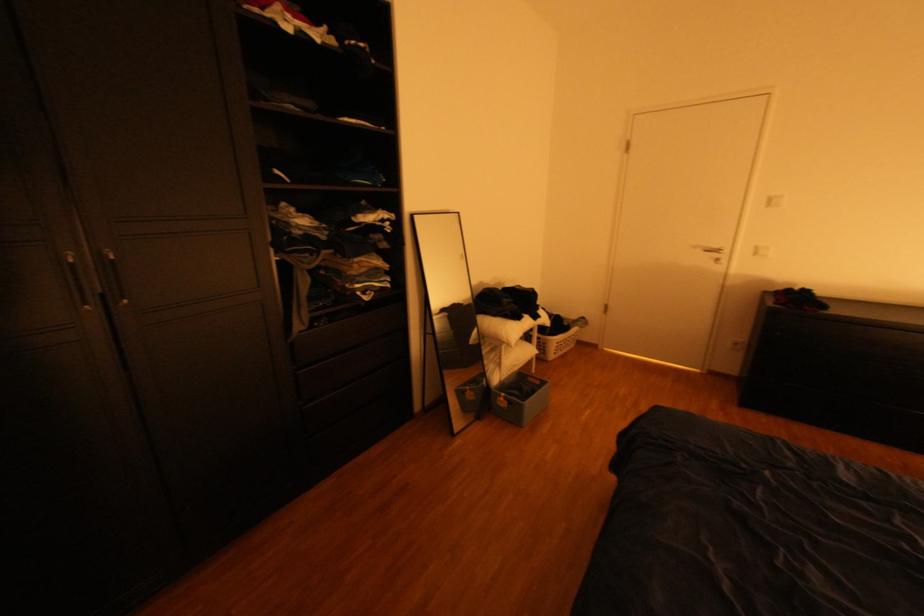
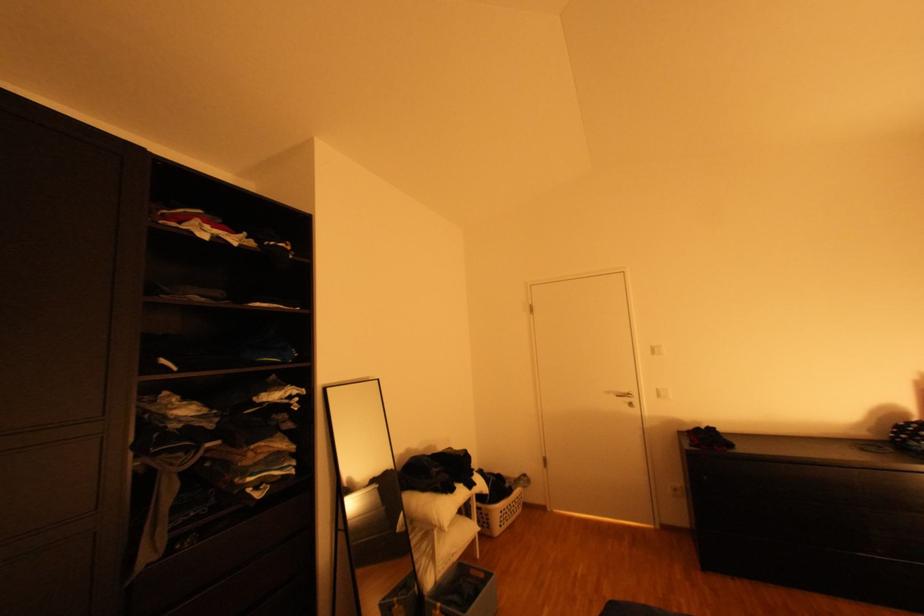
Locate, in the second image, the point that corresponds to point 787,334 in the first image.

(715, 477)